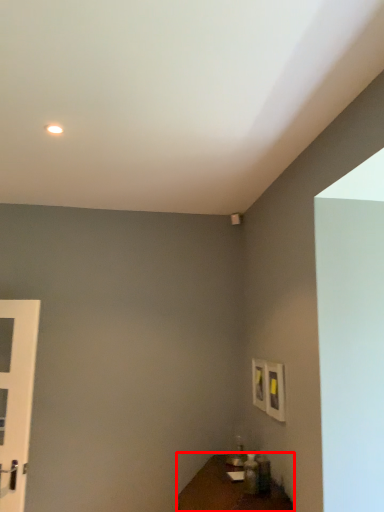
Question: From the image's perspective, considering the relative positions of table (annotated by the red box) and door in the image provided, where is table (annotated by the red box) located with respect to the staircase?

Choices:
 (A) below
 (B) above

Answer: (A)